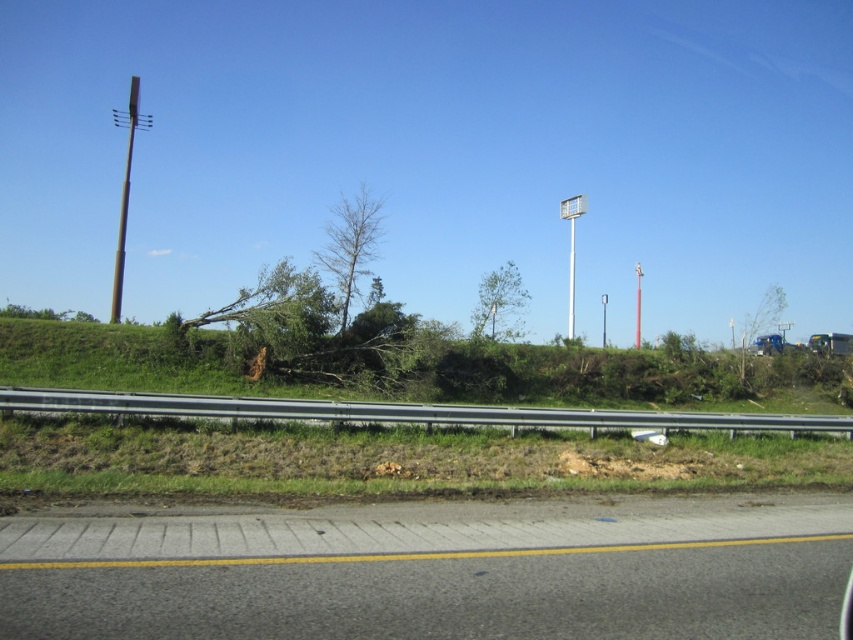
Question: Which point is farther from the camera taking this photo?

Choices:
 (A) (640, 296)
 (B) (521, 282)
 (C) (132, 531)
 (D) (569, 321)

Answer: (A)

Question: Where is green leafy tree at center located in relation to white plastic street sign at upper center in the image?

Choices:
 (A) right
 (B) left

Answer: (B)

Question: Based on their relative distances, which object is farther from the metallic pole at center?

Choices:
 (A) white plastic street sign at upper center
 (B) asphalt at lower center
 (C) silver metallic guardrail at center
 (D) bare wood tree at center

Answer: (B)

Question: Where is silver metallic guardrail at center located in relation to metallic pole at center-right in the image?

Choices:
 (A) below
 (B) above

Answer: (A)

Question: Which point appears closest to the camera in this image?

Choices:
 (A) (505, 305)
 (B) (563, 198)

Answer: (A)

Question: Is green leafy tree at right closer to the viewer compared to white plastic sign at upper center?

Choices:
 (A) no
 (B) yes

Answer: (B)